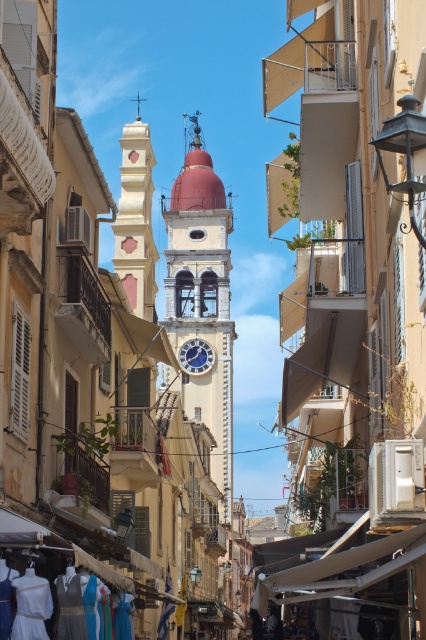
Question: Can you confirm if white cotton dresses at lower left is wider than blue glass clock at center?

Choices:
 (A) no
 (B) yes

Answer: (B)

Question: Among these objects, which one is farthest from the camera?

Choices:
 (A) blue glass clock at center
 (B) smooth white church at center

Answer: (A)

Question: Which is nearer to the white stone clock tower at center?

Choices:
 (A) white cotton dresses at lower left
 (B) blue glass clock at center

Answer: (B)

Question: Is smooth white church at center positioned at the back of white cotton dresses at lower left?

Choices:
 (A) yes
 (B) no

Answer: (B)

Question: Which point appears farthest from the camera in this image?

Choices:
 (A) (45, 616)
 (B) (189, 371)
 (C) (198, 248)
 (D) (370, 401)

Answer: (C)

Question: Considering the relative positions of white stone clock tower at center and white cotton dresses at lower left in the image provided, where is white stone clock tower at center located with respect to white cotton dresses at lower left?

Choices:
 (A) left
 (B) right

Answer: (B)